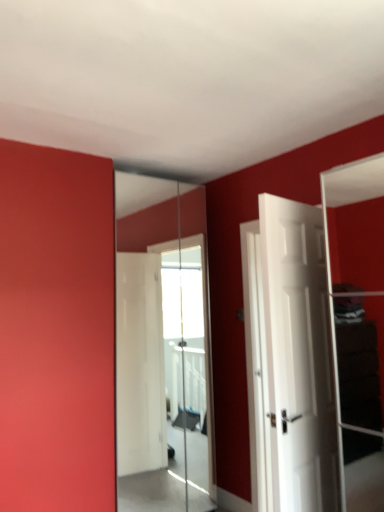
This screenshot has width=384, height=512. What are the coordinates of `clear glass mirror at center` in the screenshot? It's located at (161, 348).

What do you see at coordinates (161, 348) in the screenshot? I see `clear glass mirror at center` at bounding box center [161, 348].

Image resolution: width=384 pixels, height=512 pixels. What do you see at coordinates (298, 357) in the screenshot?
I see `white matte door at right` at bounding box center [298, 357].

Identify the location of white matte door at right. Image resolution: width=384 pixels, height=512 pixels. (298, 357).

This screenshot has height=512, width=384. In order to click on clear glass mirror at center in this screenshot , I will do `click(161, 348)`.

From the picture: Which is more to the left, clear glass mirror at center or white matte door at right?

Positioned to the left is clear glass mirror at center.

Is the depth of clear glass mirror at center less than that of white matte door at right?

No, it is not.

Is point (197, 240) in front of point (269, 334)?

No.

From the image's perspective, which is below, clear glass mirror at center or white matte door at right?

clear glass mirror at center is shown below in the image.

Consider the image. From a real-world perspective, is clear glass mirror at center positioned above or below white matte door at right?

clear glass mirror at center is situated higher than white matte door at right in the real world.

Does clear glass mirror at center have a lesser width compared to white matte door at right?

Yes.

Considering the sizes of clear glass mirror at center and white matte door at right in the image, is clear glass mirror at center taller or shorter than white matte door at right?

In the image, clear glass mirror at center appears to be taller than white matte door at right.

Considering the sizes of objects clear glass mirror at center and white matte door at right in the image provided, who is bigger, clear glass mirror at center or white matte door at right?

With larger size is clear glass mirror at center.

Is clear glass mirror at center not inside white matte door at right?

Yes, clear glass mirror at center is outside of white matte door at right.

Are clear glass mirror at center and white matte door at right located far from each other?

That's right, there is a large distance between clear glass mirror at center and white matte door at right.

Consider the image. Is clear glass mirror at center facing towards white matte door at right?

Yes, clear glass mirror at center is oriented towards white matte door at right.

How many degrees apart are the facing directions of clear glass mirror at center and white matte door at right?

The angular difference between clear glass mirror at center and white matte door at right is 171 degrees.

How far apart are clear glass mirror at center and white matte door at right?

1.66 meters.

The height and width of the screenshot is (512, 384). Identify the location of mirror below the white matte door at right (from the image's perspective). (161, 348).

Is white matte door at right to the left of clear glass mirror at center from the viewer's perspective?

In fact, white matte door at right is to the right of clear glass mirror at center.

Does white matte door at right lie in front of clear glass mirror at center?

Yes, white matte door at right is in front of clear glass mirror at center.

Is point (330, 391) closer or farther from the camera than point (177, 448)?

Point (330, 391) appears to be closer to the viewer than point (177, 448).

From the image's perspective, which one is positioned lower, white matte door at right or clear glass mirror at center?

clear glass mirror at center appears lower in the image.

From a real-world perspective, is white matte door at right under clear glass mirror at center?

Correct, in the physical world, white matte door at right is lower than clear glass mirror at center.

Which of these two, white matte door at right or clear glass mirror at center, is thinner?

clear glass mirror at center is thinner.

Can you confirm if white matte door at right is taller than clear glass mirror at center?

In fact, white matte door at right may be shorter than clear glass mirror at center.

Based on their sizes in the image, would you say white matte door at right is bigger or smaller than clear glass mirror at center?

In the image, white matte door at right appears to be smaller than clear glass mirror at center.

Is clear glass mirror at center inside white matte door at right?

No, clear glass mirror at center is not inside white matte door at right.

Are white matte door at right and clear glass mirror at center far apart?

Absolutely, white matte door at right is distant from clear glass mirror at center.

Is white matte door at right oriented away from clear glass mirror at center?

No, white matte door at right is not facing away from clear glass mirror at center.

How far apart are white matte door at right and clear glass mirror at center?

1.66 meters.

This screenshot has width=384, height=512. What are the coordinates of `door above the clear glass mirror at center (from the image's perspective)` in the screenshot? It's located at (298, 357).

Identify the location of mirror that appears on the left of white matte door at right. (161, 348).

This screenshot has height=512, width=384. I want to click on door below the clear glass mirror at center (from a real-world perspective), so click(x=298, y=357).